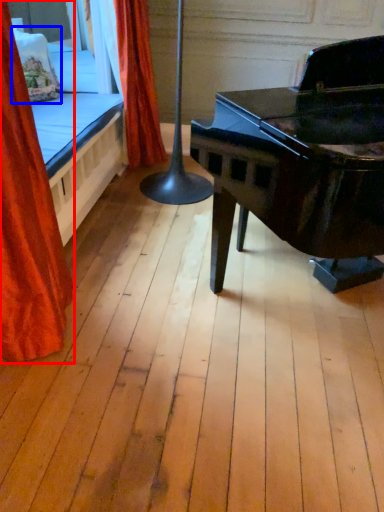
Question: Which object is closer to the camera taking this photo, curtain (highlighted by a red box) or pillow (highlighted by a blue box)?

Choices:
 (A) curtain
 (B) pillow

Answer: (A)